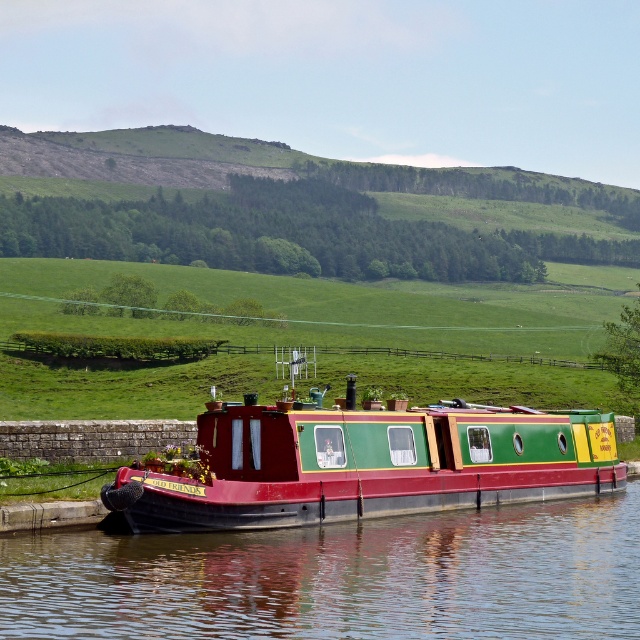
Which is above, smooth dark water at center or matte green and red boat at center?

matte green and red boat at center is higher up.

Can you confirm if smooth dark water at center is positioned below matte green and red boat at center?

Indeed, smooth dark water at center is positioned under matte green and red boat at center.

Measure the distance between smooth dark water at center and camera.

smooth dark water at center and camera are 22.59 meters apart from each other.

What are the coordinates of `smooth dark water at center` in the screenshot? It's located at pos(340,577).